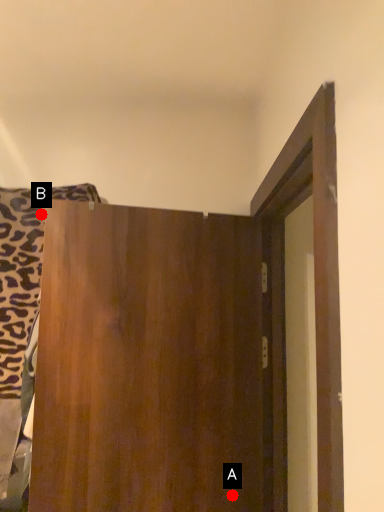
Question: Two points are circled on the image, labeled by A and B beside each circle. Which point is farther to the camera?

Choices:
 (A) A is further
 (B) B is further

Answer: (B)